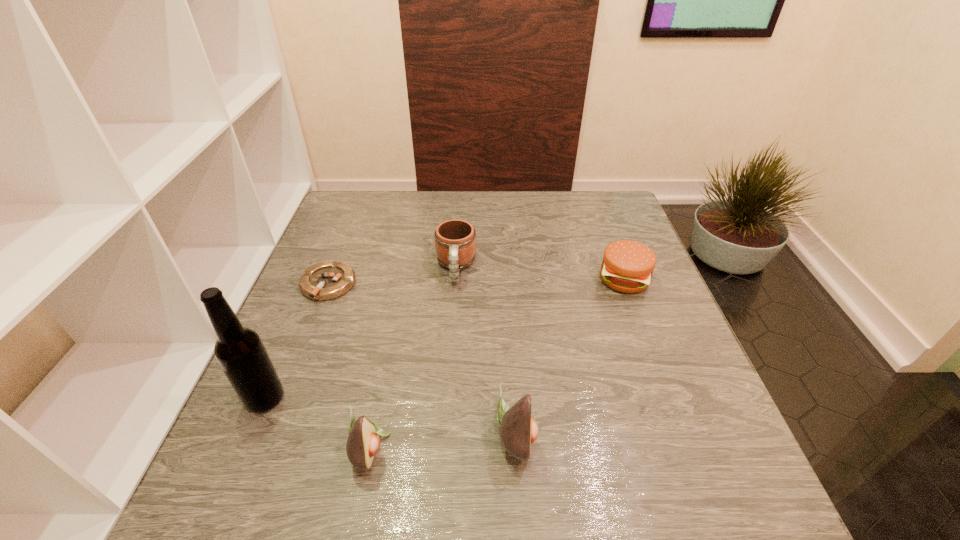
Where is `the fourth shortest object`? This screenshot has height=540, width=960. the fourth shortest object is located at coordinates (363, 442).

This screenshot has height=540, width=960. I want to click on the left avocado, so click(x=363, y=442).

The height and width of the screenshot is (540, 960). I want to click on the right avocado, so click(x=518, y=430).

You are a GUI agent. You are given a task and a screenshot of the screen. Output one action in this format:
    pyautogui.click(x=<x>, y=<y>)
    Task: Click on the second object from right to left
    
    Given the screenshot: What is the action you would take?
    pyautogui.click(x=518, y=430)

This screenshot has width=960, height=540. Find the location of `the fourth object from left to right`. the fourth object from left to right is located at coordinates (455, 240).

Identify the location of hamburger. The image size is (960, 540). (627, 266).

This screenshot has width=960, height=540. I want to click on the shortest object, so click(327, 280).

Where is `the tallest object`? The width and height of the screenshot is (960, 540). the tallest object is located at coordinates (240, 352).

This screenshot has height=540, width=960. Identify the location of vacant space situated on the seed side of the third tallest object. (523, 447).

In order to click on vacant region located on the seed side of the right avocado in this screenshot , I will do `click(730, 434)`.